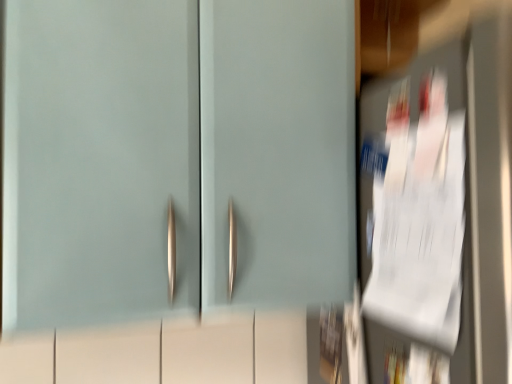
What do you see at coordinates (440, 214) in the screenshot?
I see `white paper at right, which is the 2th door in left-to-right order` at bounding box center [440, 214].

At what (x,y) coordinates should I click in order to perform the action: click on white paper at right, which is the 2th door in left-to-right order. Please return your answer as a coordinate pair (x, y). The width and height of the screenshot is (512, 384). Looking at the image, I should click on (440, 214).

The height and width of the screenshot is (384, 512). What do you see at coordinates (100, 161) in the screenshot?
I see `matte teal cabinet at center, marked as the 2th door in a right-to-left arrangement` at bounding box center [100, 161].

The image size is (512, 384). What are the coordinates of `matte teal cabinet at center, which ranks as the 1th door in left-to-right order` in the screenshot? It's located at (100, 161).

Where is `white paper at right, which is the 2th door in left-to-right order`? Image resolution: width=512 pixels, height=384 pixels. white paper at right, which is the 2th door in left-to-right order is located at coordinates (440, 214).

Is matte teal cabinet at center, marked as the 2th door in a right-to-left arrangement, at the left side of white paper at right, placed as the first door when sorted from right to left?

Yes, matte teal cabinet at center, marked as the 2th door in a right-to-left arrangement, is to the left of white paper at right, placed as the first door when sorted from right to left.

Is matte teal cabinet at center, marked as the 2th door in a right-to-left arrangement, positioned before white paper at right, placed as the first door when sorted from right to left?

No, it is not.

Is point (114, 236) closer or farther from the camera than point (366, 182)?

Point (114, 236) appears to be closer to the viewer than point (366, 182).

From the image's perspective, which one is positioned higher, matte teal cabinet at center, which ranks as the 1th door in left-to-right order, or white paper at right, placed as the first door when sorted from right to left?

matte teal cabinet at center, which ranks as the 1th door in left-to-right order, appears higher in the image.

From a real-world perspective, does matte teal cabinet at center, marked as the 2th door in a right-to-left arrangement, sit lower than white paper at right, which is the 2th door in left-to-right order?

Actually, matte teal cabinet at center, marked as the 2th door in a right-to-left arrangement, is physically above white paper at right, which is the 2th door in left-to-right order, in the real world.

Looking at their sizes, would you say matte teal cabinet at center, marked as the 2th door in a right-to-left arrangement, is wider or thinner than white paper at right, which is the 2th door in left-to-right order?

Considering their sizes, matte teal cabinet at center, marked as the 2th door in a right-to-left arrangement, looks slimmer than white paper at right, which is the 2th door in left-to-right order.

Who is taller, matte teal cabinet at center, which ranks as the 1th door in left-to-right order, or white paper at right, placed as the first door when sorted from right to left?

A: Standing taller between the two is white paper at right, placed as the first door when sorted from right to left.

Who is smaller, matte teal cabinet at center, marked as the 2th door in a right-to-left arrangement, or white paper at right, placed as the first door when sorted from right to left?

Smaller between the two is matte teal cabinet at center, marked as the 2th door in a right-to-left arrangement.

Is white paper at right, which is the 2th door in left-to-right order, inside matte teal cabinet at center, marked as the 2th door in a right-to-left arrangement?

No, white paper at right, which is the 2th door in left-to-right order, is not a part of matte teal cabinet at center, marked as the 2th door in a right-to-left arrangement.

Are matte teal cabinet at center, marked as the 2th door in a right-to-left arrangement, and white paper at right, placed as the first door when sorted from right to left, far apart?

matte teal cabinet at center, marked as the 2th door in a right-to-left arrangement, is actually quite close to white paper at right, placed as the first door when sorted from right to left.

Is matte teal cabinet at center, marked as the 2th door in a right-to-left arrangement, positioned with its back to white paper at right, placed as the first door when sorted from right to left?

No.

What's the angular difference between matte teal cabinet at center, marked as the 2th door in a right-to-left arrangement, and white paper at right, which is the 2th door in left-to-right order,'s facing directions?

0.619 degrees separate the facing orientations of matte teal cabinet at center, marked as the 2th door in a right-to-left arrangement, and white paper at right, which is the 2th door in left-to-right order.

Could you measure the distance between matte teal cabinet at center, marked as the 2th door in a right-to-left arrangement, and white paper at right, which is the 2th door in left-to-right order?

They are 16.17 inches apart.

Where is `door below the matte teal cabinet at center, which ranks as the 1th door in left-to-right order (from the image's perspective)`? The image size is (512, 384). door below the matte teal cabinet at center, which ranks as the 1th door in left-to-right order (from the image's perspective) is located at coordinates (440, 214).

Which is more to the right, white paper at right, placed as the first door when sorted from right to left, or matte teal cabinet at center, which ranks as the 1th door in left-to-right order?

white paper at right, placed as the first door when sorted from right to left.

Is white paper at right, which is the 2th door in left-to-right order, in front of or behind matte teal cabinet at center, which ranks as the 1th door in left-to-right order, in the image?

white paper at right, which is the 2th door in left-to-right order, is positioned closer to the viewer than matte teal cabinet at center, which ranks as the 1th door in left-to-right order.

Does point (443, 154) come farther from viewer compared to point (134, 122)?

No, it is not.

From the image's perspective, is white paper at right, placed as the first door when sorted from right to left, over matte teal cabinet at center, which ranks as the 1th door in left-to-right order?

Incorrect, from the image's perspective, white paper at right, placed as the first door when sorted from right to left, is lower than matte teal cabinet at center, which ranks as the 1th door in left-to-right order.

In the scene shown: From a real-world perspective, which is physically below, white paper at right, which is the 2th door in left-to-right order, or matte teal cabinet at center, which ranks as the 1th door in left-to-right order?

From a 3D spatial view, white paper at right, which is the 2th door in left-to-right order, is below.

Considering the sizes of objects white paper at right, placed as the first door when sorted from right to left, and matte teal cabinet at center, which ranks as the 1th door in left-to-right order, in the image provided, who is thinner, white paper at right, placed as the first door when sorted from right to left, or matte teal cabinet at center, which ranks as the 1th door in left-to-right order,?

Thinner between the two is matte teal cabinet at center, which ranks as the 1th door in left-to-right order.

Between white paper at right, placed as the first door when sorted from right to left, and matte teal cabinet at center, marked as the 2th door in a right-to-left arrangement, which one has less height?

matte teal cabinet at center, marked as the 2th door in a right-to-left arrangement.

Which of these two, white paper at right, which is the 2th door in left-to-right order, or matte teal cabinet at center, which ranks as the 1th door in left-to-right order, is smaller?

matte teal cabinet at center, which ranks as the 1th door in left-to-right order.

Is white paper at right, which is the 2th door in left-to-right order, inside the boundaries of matte teal cabinet at center, which ranks as the 1th door in left-to-right order, or outside?

The correct answer is: outside.

Would you consider white paper at right, placed as the first door when sorted from right to left, to be distant from matte teal cabinet at center, which ranks as the 1th door in left-to-right order?

white paper at right, placed as the first door when sorted from right to left, is near matte teal cabinet at center, which ranks as the 1th door in left-to-right order, not far away.

Is white paper at right, which is the 2th door in left-to-right order, positioned with its back to matte teal cabinet at center, marked as the 2th door in a right-to-left arrangement?

white paper at right, which is the 2th door in left-to-right order, is not turned away from matte teal cabinet at center, marked as the 2th door in a right-to-left arrangement.

What's the angular difference between white paper at right, placed as the first door when sorted from right to left, and matte teal cabinet at center, marked as the 2th door in a right-to-left arrangement,'s facing directions?

white paper at right, placed as the first door when sorted from right to left, and matte teal cabinet at center, marked as the 2th door in a right-to-left arrangement, are facing 0.619 degrees away from each other.

Based on the photo, how far apart are white paper at right, placed as the first door when sorted from right to left, and matte teal cabinet at center, which ranks as the 1th door in left-to-right order?

white paper at right, placed as the first door when sorted from right to left, and matte teal cabinet at center, which ranks as the 1th door in left-to-right order, are 41.08 centimeters apart.

Where is `door on the right of matte teal cabinet at center, which ranks as the 1th door in left-to-right order`? The image size is (512, 384). door on the right of matte teal cabinet at center, which ranks as the 1th door in left-to-right order is located at coordinates (440, 214).

The width and height of the screenshot is (512, 384). In order to click on door located on the right of matte teal cabinet at center, marked as the 2th door in a right-to-left arrangement in this screenshot , I will do `click(440, 214)`.

The height and width of the screenshot is (384, 512). Identify the location of door beneath the matte teal cabinet at center, which ranks as the 1th door in left-to-right order (from a real-world perspective). (440, 214).